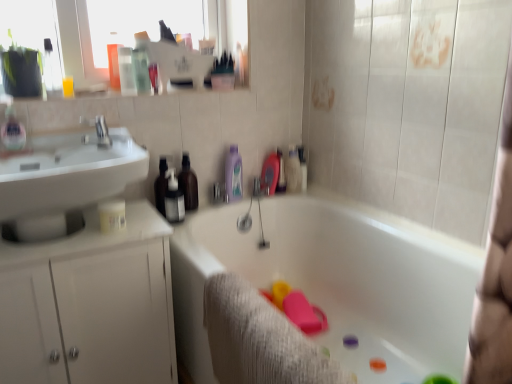
Describe the element at coordinates (260, 339) in the screenshot. The width and height of the screenshot is (512, 384). I see `gray textured bath towel at lower center` at that location.

You are a GUI agent. You are given a task and a screenshot of the screen. Output one action in this format:
    pyautogui.click(x=<x>, y=<y>)
    Task: Click on the white glossy bathtub at center
    The image size is (512, 384).
    Given the screenshot: What is the action you would take?
    pyautogui.click(x=336, y=281)

Locate an element on the screen. Image resolution: width=512 pixels, height=384 pixels. translucent plastic bottle at center, which ranks as the 2th toiletry in right-to-left order is located at coordinates (233, 175).

You are a GUI agent. You are given a task and a screenshot of the screen. Output one action in this format:
    pyautogui.click(x=<x>, y=<y>)
    Task: Click on the silver metallic faucet at upper left
    The image size is (512, 384).
    Given the screenshot: What is the action you would take?
    pyautogui.click(x=99, y=130)

Find the location of a particular element. The height and width of the screenshot is (384, 512). translucent plastic soap dispenser at left is located at coordinates (12, 130).

From the image's perspective, is translucent plastic bottle at center, which ranks as the 2th toiletry in right-to-left order, above or below brown matte bottle at center, marked as the 3th toiletry in a right-to-left arrangement?

translucent plastic bottle at center, which ranks as the 2th toiletry in right-to-left order, is situated higher than brown matte bottle at center, marked as the 3th toiletry in a right-to-left arrangement, in the image.

Considering the relative positions of translucent plastic bottle at center, the 2th toiletry in the left-to-right sequence, and brown matte bottle at center, marked as the 3th toiletry in a right-to-left arrangement, in the image provided, is translucent plastic bottle at center, the 2th toiletry in the left-to-right sequence, to the left of brown matte bottle at center, marked as the 3th toiletry in a right-to-left arrangement, from the viewer's perspective?

No.

Are translucent plastic bottle at center, which ranks as the 2th toiletry in right-to-left order, and brown matte bottle at center, which is the 1th toiletry from left to right, located far from each other?

No, translucent plastic bottle at center, which ranks as the 2th toiletry in right-to-left order, is in close proximity to brown matte bottle at center, which is the 1th toiletry from left to right.

In terms of size, does silver metallic faucet at upper left appear bigger or smaller than white glossy cabinet at left?

Clearly, silver metallic faucet at upper left is smaller in size than white glossy cabinet at left.

From the image's perspective, relative to white glossy cabinet at left, is silver metallic faucet at upper left above or below?

silver metallic faucet at upper left is above white glossy cabinet at left.

Is silver metallic faucet at upper left facing away from white glossy cabinet at left?

No, silver metallic faucet at upper left is not facing the opposite direction of white glossy cabinet at left.

Is translucent plastic soap dispenser at left inside silver metallic faucet at upper left?

No, translucent plastic soap dispenser at left is not inside silver metallic faucet at upper left.

This screenshot has height=384, width=512. Identify the location of bottle on the left of silver metallic faucet at upper left. (12, 130).

Is silver metallic faucet at upper left taller or shorter than translucent plastic soap dispenser at left?

silver metallic faucet at upper left is shorter than translucent plastic soap dispenser at left.

From a real-world perspective, which is physically above, silver metallic faucet at upper left or translucent plastic soap dispenser at left?

From a 3D spatial view, translucent plastic soap dispenser at left is above.

Is silver metallic faucet at upper left with brown matte bottle at center, which is the 1th toiletry from left to right?

No, silver metallic faucet at upper left is not beside brown matte bottle at center, which is the 1th toiletry from left to right.

From the picture: Does silver metallic faucet at upper left have a lesser width compared to brown matte bottle at center, marked as the 3th toiletry in a right-to-left arrangement?

No.

Does point (106, 138) lie in front of point (184, 161)?

That is True.

Considering the sizes of objects translucent plastic soap dispenser at left and brown matte bottle at center, which is the 1th toiletry from left to right, in the image provided, who is smaller, translucent plastic soap dispenser at left or brown matte bottle at center, which is the 1th toiletry from left to right,?

translucent plastic soap dispenser at left.

Which is closer, [15,122] or [190,202]?

Clearly, point [15,122] is closer to the camera than point [190,202].

Does translucent plastic soap dispenser at left have a greater height compared to brown matte bottle at center, marked as the 3th toiletry in a right-to-left arrangement?

No, translucent plastic soap dispenser at left is not taller than brown matte bottle at center, marked as the 3th toiletry in a right-to-left arrangement.

Is translucent plastic soap dispenser at left to the left or to the right of brown matte bottle at center, marked as the 3th toiletry in a right-to-left arrangement, in the image?

translucent plastic soap dispenser at left is to the left of brown matte bottle at center, marked as the 3th toiletry in a right-to-left arrangement.

Between silver metallic faucet at upper left and translucent plastic bottle at center, the 2th toiletry in the left-to-right sequence, which one appears on the left side from the viewer's perspective?

Positioned to the left is silver metallic faucet at upper left.

Is silver metallic faucet at upper left not near translucent plastic bottle at center, the 2th toiletry in the left-to-right sequence?

No.

Is silver metallic faucet at upper left wider than translucent plastic bottle at center, which ranks as the 2th toiletry in right-to-left order?

Yes, silver metallic faucet at upper left is wider than translucent plastic bottle at center, which ranks as the 2th toiletry in right-to-left order.

From a real-world perspective, between silver metallic faucet at upper left and translucent plastic bottle at center, the 2th toiletry in the left-to-right sequence, who is vertically higher?

silver metallic faucet at upper left is physically above.

Does white glossy sink at left appear on the left side of white glossy cabinet at left?

Yes.

Is white glossy sink at left far away from white glossy cabinet at left?

No, white glossy sink at left is not far from white glossy cabinet at left.

Locate an element on the screen. The width and height of the screenshot is (512, 384). bathroom cabinet that is on the right side of white glossy sink at left is located at coordinates (90, 305).

From a real-world perspective, which is physically above, white glossy sink at left or white glossy cabinet at left?

white glossy sink at left.

The height and width of the screenshot is (384, 512). I want to click on the 1st toiletry below the brown matte bottle at center, marked as the 3th toiletry in a right-to-left arrangement (from a real-world perspective), so click(x=233, y=175).

You are a GUI agent. You are given a task and a screenshot of the screen. Output one action in this format:
    pyautogui.click(x=<x>, y=<y>)
    Task: Click on the tap above the white glossy cabinet at left (from the image's perspective)
    
    Given the screenshot: What is the action you would take?
    99,130

Estimate the real-world distances between objects in this image. Which object is further from white glossy sink at left, translucent plastic bottle at center, the 2th toiletry in the left-to-right sequence, or silver metallic faucet at upper left?

Among the two, translucent plastic bottle at center, the 2th toiletry in the left-to-right sequence, is located further to white glossy sink at left.

Looking at the image, which one is located further to silver metallic faucet at upper left, white glossy cabinet at left or white matte bottle at upper center, which ranks as the 1th toiletry in right-to-left order?

white matte bottle at upper center, which ranks as the 1th toiletry in right-to-left order, is positioned further to the anchor silver metallic faucet at upper left.

Which object lies further to the anchor point silver metallic faucet at upper left, white matte bottle at upper center, which ranks as the 3th toiletry in left-to-right order, or white glossy cabinet at left?

white matte bottle at upper center, which ranks as the 3th toiletry in left-to-right order, is further to silver metallic faucet at upper left.

Consider the image. Based on their spatial positions, is translucent plastic soap dispenser at left or white glossy sink at left further from brown matte bottle at center, which is the 1th toiletry from left to right?

translucent plastic soap dispenser at left lies further to brown matte bottle at center, which is the 1th toiletry from left to right, than the other object.

Looking at the image, which one is located further to silver metallic faucet at upper left, translucent plastic soap dispenser at left or white glossy bathtub at center?

The object further to silver metallic faucet at upper left is white glossy bathtub at center.

Looking at the image, which one is located further to translucent plastic soap dispenser at left, translucent plastic bottle at center, which ranks as the 2th toiletry in right-to-left order, or white glossy sink at left?

translucent plastic bottle at center, which ranks as the 2th toiletry in right-to-left order, is positioned further to the anchor translucent plastic soap dispenser at left.

Estimate the real-world distances between objects in this image. Which object is closer to gray textured bath towel at lower center, white matte bottle at upper center, which ranks as the 3th toiletry in left-to-right order, or brown matte bottle at center, which is the 1th toiletry from left to right?

brown matte bottle at center, which is the 1th toiletry from left to right, is positioned closer to the anchor gray textured bath towel at lower center.

Considering their positions, is white matte bottle at upper center, which ranks as the 1th toiletry in right-to-left order, positioned closer to translucent plastic soap dispenser at left than white glossy cabinet at left?

Based on the image, white glossy cabinet at left appears to be nearer to translucent plastic soap dispenser at left.

Where is `bathroom cabinet positioned between white glossy sink at left and translucent plastic bottle at center, the 2th toiletry in the left-to-right sequence, from near to far`? This screenshot has width=512, height=384. bathroom cabinet positioned between white glossy sink at left and translucent plastic bottle at center, the 2th toiletry in the left-to-right sequence, from near to far is located at coordinates (90, 305).

Locate an element on the screen. The image size is (512, 384). sink between silver metallic faucet at upper left and gray textured bath towel at lower center from top to bottom is located at coordinates (66, 178).

Identify the location of sink between gray textured bath towel at lower center and brown matte bottle at center, marked as the 3th toiletry in a right-to-left arrangement, from front to back. The image size is (512, 384). (66, 178).

Identify the location of tap between gray textured bath towel at lower center and translucent plastic bottle at center, which ranks as the 2th toiletry in right-to-left order, along the z-axis. The height and width of the screenshot is (384, 512). (99, 130).